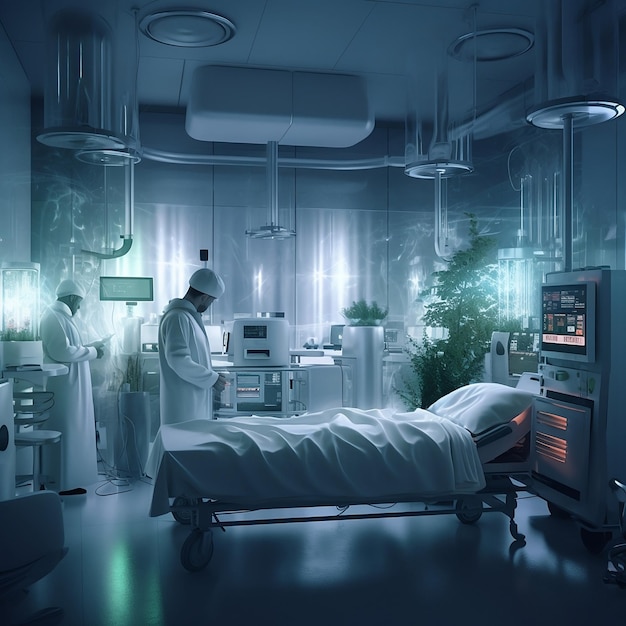
At what (x,y) coordinates should I click in order to perform the action: click on hospital bed. Please return your answer as a coordinate pair (x, y). Looking at the image, I should click on (342, 519).